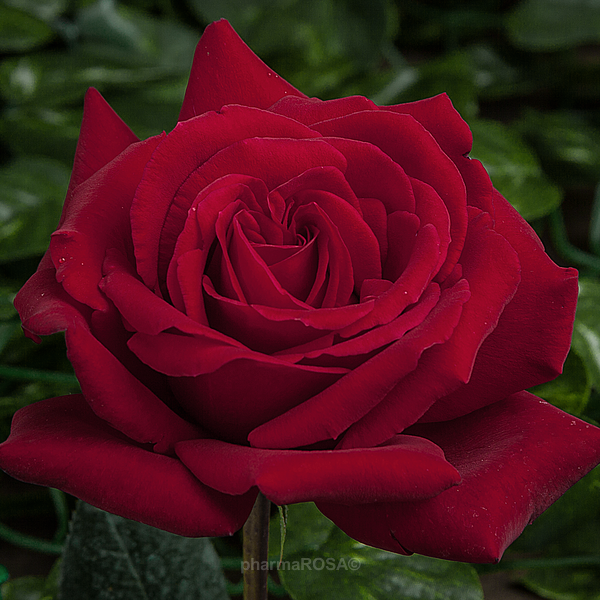
Where is `right corner`? This screenshot has height=600, width=600. right corner is located at coordinates (580, 14).